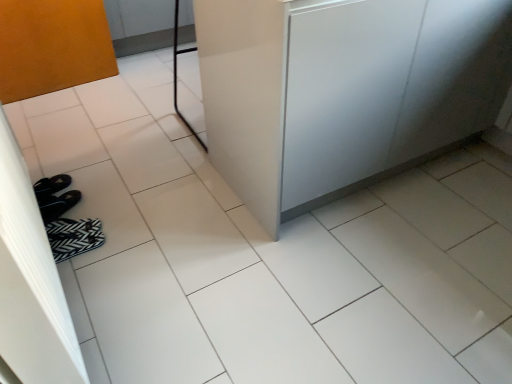
Question: Is satin white counter at center shorter than black fabric flip-flops at lower left?

Choices:
 (A) yes
 (B) no

Answer: (B)

Question: Considering the relative positions of satin white counter at center and black fabric flip-flops at lower left in the image provided, is satin white counter at center to the right of black fabric flip-flops at lower left from the viewer's perspective?

Choices:
 (A) no
 (B) yes

Answer: (B)

Question: Could you tell me if satin white counter at center is facing black fabric flip-flops at lower left?

Choices:
 (A) yes
 (B) no

Answer: (B)

Question: Does satin white counter at center have a larger size compared to black fabric flip-flops at lower left?

Choices:
 (A) no
 (B) yes

Answer: (B)

Question: Is satin white counter at center touching black fabric flip-flops at lower left?

Choices:
 (A) yes
 (B) no

Answer: (B)

Question: From the image's perspective, is satin white counter at center located above black fabric flip-flops at lower left?

Choices:
 (A) yes
 (B) no

Answer: (A)

Question: Can you confirm if matte orange screen door at left is positioned to the right of black fabric flip-flops at lower left?

Choices:
 (A) no
 (B) yes

Answer: (A)

Question: Can you confirm if matte orange screen door at left is thinner than black fabric flip-flops at lower left?

Choices:
 (A) yes
 (B) no

Answer: (A)

Question: From a real-world perspective, is matte orange screen door at left below black fabric flip-flops at lower left?

Choices:
 (A) yes
 (B) no

Answer: (B)

Question: Is matte orange screen door at left looking in the opposite direction of black fabric flip-flops at lower left?

Choices:
 (A) yes
 (B) no

Answer: (B)

Question: From the image's perspective, is matte orange screen door at left beneath black fabric flip-flops at lower left?

Choices:
 (A) yes
 (B) no

Answer: (B)

Question: Does matte orange screen door at left have a lesser height compared to black fabric flip-flops at lower left?

Choices:
 (A) no
 (B) yes

Answer: (A)

Question: Is satin white counter at center wider than matte orange screen door at left?

Choices:
 (A) no
 (B) yes

Answer: (B)